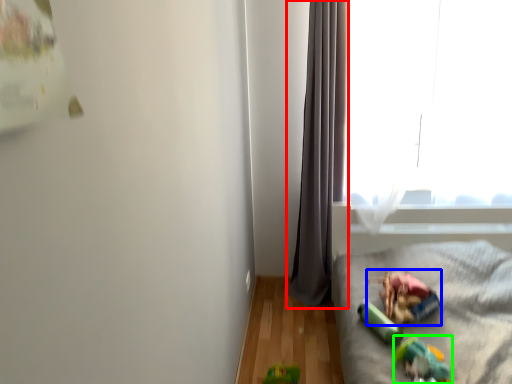
Question: Estimate the real-world distances between objects in this image. Which object is closer to curtain (highlighted by a red box), stuff (highlighted by a blue box) or toy (highlighted by a green box)?

Choices:
 (A) stuff
 (B) toy

Answer: (A)